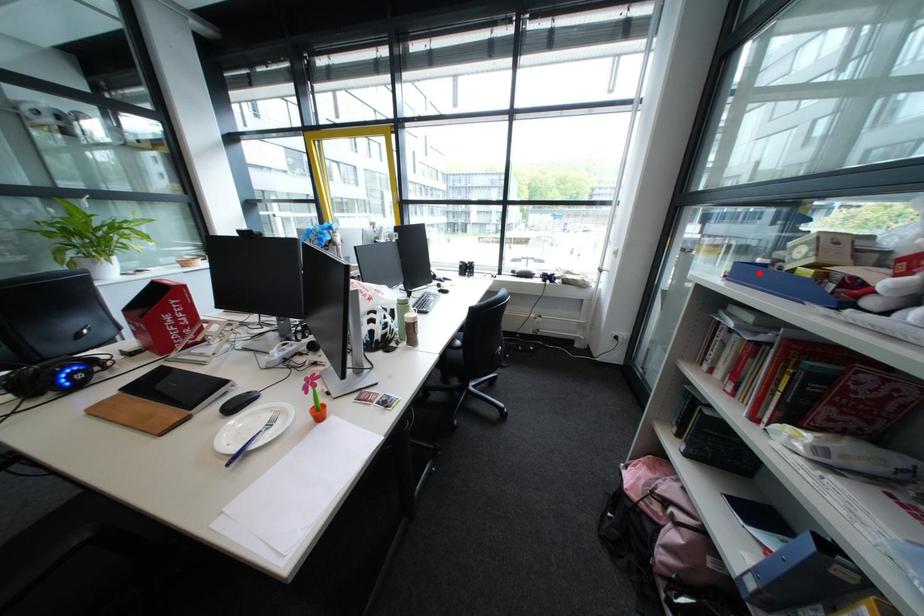
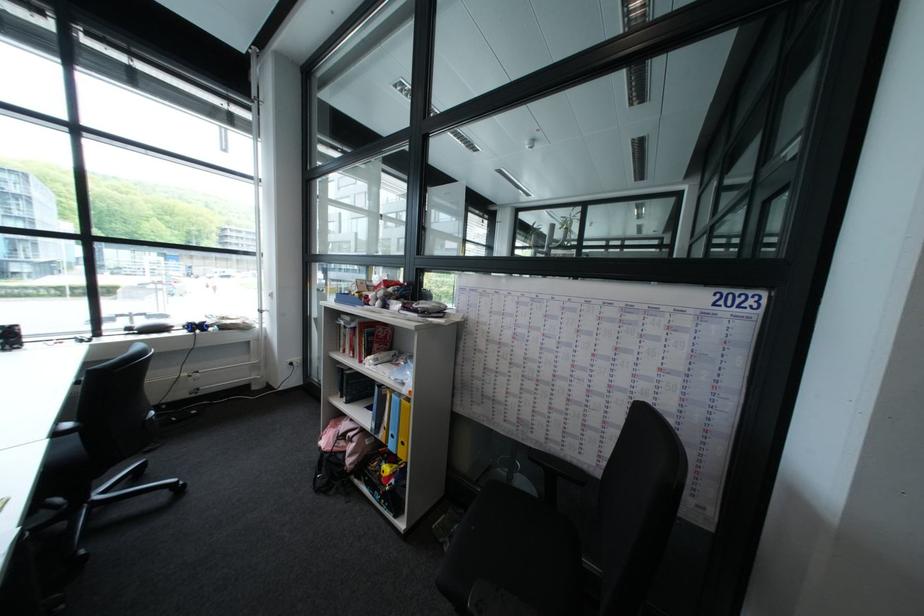
The point at the highlighted location is marked in the first image. Where is the corresponding point in the second image?

(358, 299)